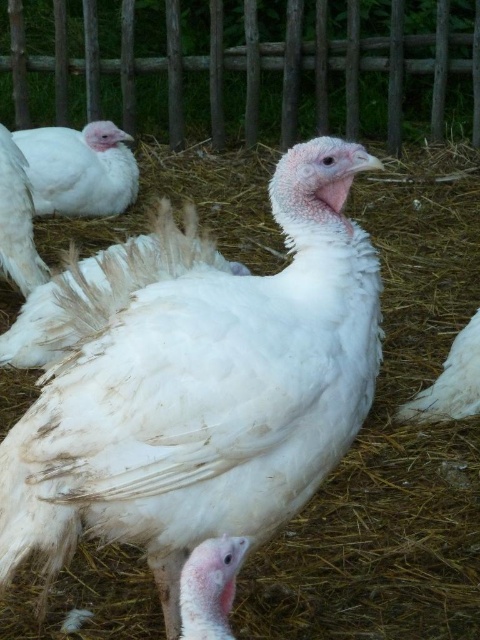
Question: Among these points, which one is farthest from the camera?

Choices:
 (A) (x=24, y=188)
 (B) (x=121, y=157)
 (C) (x=240, y=524)
 (D) (x=442, y=376)

Answer: (B)

Question: Which object is the farthest from the white feathered turkey at center?

Choices:
 (A) white feathered chicken at left
 (B) white feathered chicken at lower right
 (C) white feathered turkey at left
 (D) wooden fence at upper center

Answer: (D)

Question: Considering the relative positions of wooden fence at upper center and white feathered chicken at lower right in the image provided, where is wooden fence at upper center located with respect to white feathered chicken at lower right?

Choices:
 (A) left
 (B) right

Answer: (A)

Question: Which point is farther from the camera taking this photo?

Choices:
 (A) (72, 106)
 (B) (52, 189)
 (C) (20, 241)

Answer: (A)

Question: Does white feathered turkey at center have a lesser width compared to white feathered chicken at lower right?

Choices:
 (A) yes
 (B) no

Answer: (B)

Question: Does wooden fence at upper center have a greater width compared to white feathered turkey at left?

Choices:
 (A) no
 (B) yes

Answer: (B)